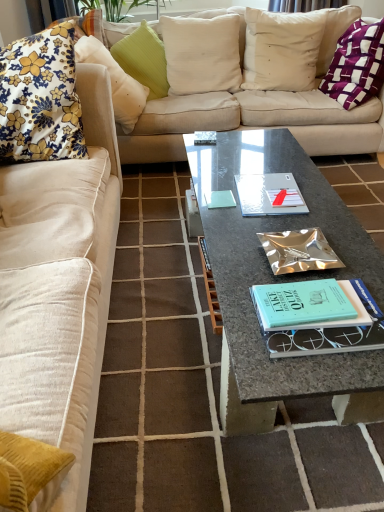
Identify the location of free spot above silver metallic notebook at center (from a real-world perspective). (275, 189).